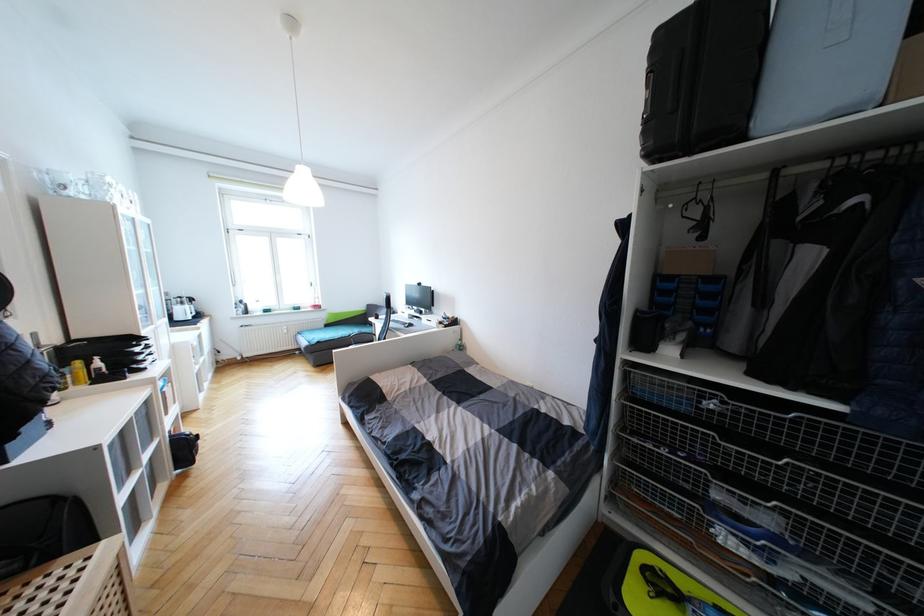
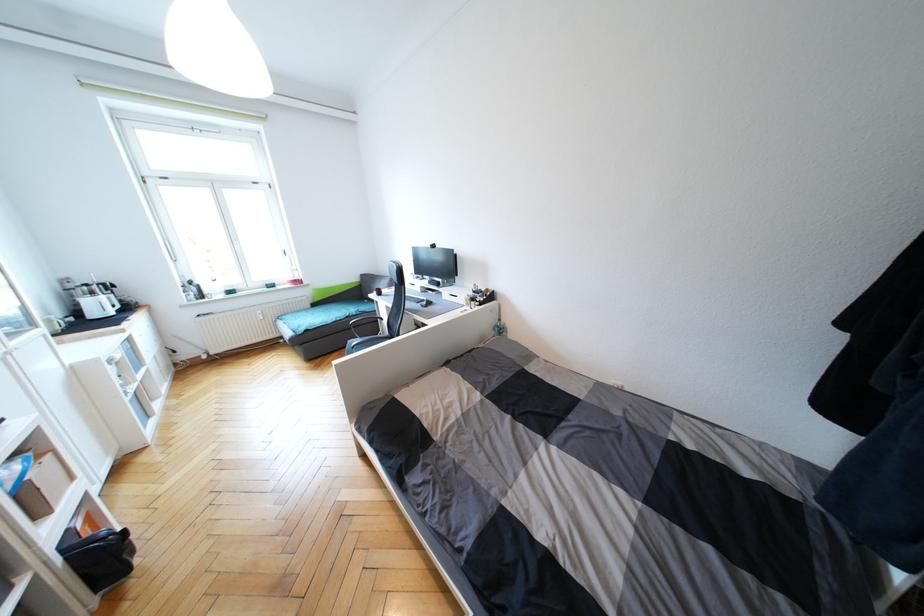
Where in the second image is the point corresponding to pixel 465 349 from the first image?

(504, 331)